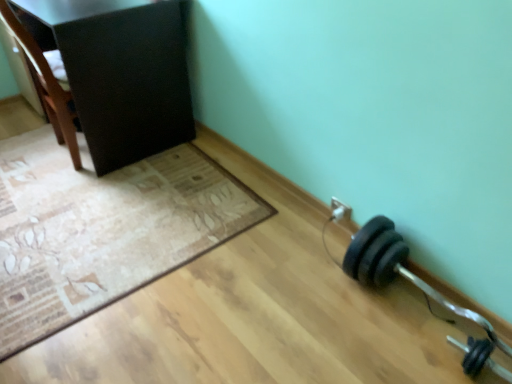
Question: From the image's perspective, is matte black cabinet at upper left over beige textured mat at lower left?

Choices:
 (A) no
 (B) yes

Answer: (B)

Question: Is matte black cabinet at upper left oriented towards beige textured mat at lower left?

Choices:
 (A) yes
 (B) no

Answer: (B)

Question: Does matte black cabinet at upper left come behind beige textured mat at lower left?

Choices:
 (A) no
 (B) yes

Answer: (B)

Question: Is matte black cabinet at upper left turned away from beige textured mat at lower left?

Choices:
 (A) yes
 (B) no

Answer: (B)

Question: Can we say matte black cabinet at upper left lies outside beige textured mat at lower left?

Choices:
 (A) no
 (B) yes

Answer: (B)

Question: Is point (463, 365) closer or farther from the camera than point (465, 350)?

Choices:
 (A) farther
 (B) closer

Answer: (B)

Question: Is black rubber dumbbell at lower right, which is the 1th dumbbell from top to bottom, taller or shorter than black rubber dumbbell at lower right, placed as the 1th dumbbell when sorted from bottom to top?

Choices:
 (A) tall
 (B) short

Answer: (A)

Question: Is black rubber dumbbell at lower right, which is the 1th dumbbell from top to bottom, bigger or smaller than black rubber dumbbell at lower right, the second dumbbell viewed from the top?

Choices:
 (A) big
 (B) small

Answer: (A)

Question: From the image's perspective, relative to black rubber dumbbell at lower right, placed as the 1th dumbbell when sorted from bottom to top, is black rubber dumbbell at lower right, the second dumbbell when ordered from bottom to top, above or below?

Choices:
 (A) above
 (B) below

Answer: (A)

Question: Is black rubber dumbbell at lower right, the second dumbbell when ordered from bottom to top, wider or thinner than brown wood chair at upper left?

Choices:
 (A) thin
 (B) wide

Answer: (A)

Question: From a real-world perspective, is black rubber dumbbell at lower right, which is the 1th dumbbell from top to bottom, physically located above or below brown wood chair at upper left?

Choices:
 (A) above
 (B) below

Answer: (B)

Question: Looking at the image, does black rubber dumbbell at lower right, which is the 1th dumbbell from top to bottom, seem bigger or smaller compared to brown wood chair at upper left?

Choices:
 (A) small
 (B) big

Answer: (A)

Question: In the image, is black rubber dumbbell at lower right, the second dumbbell when ordered from bottom to top, positioned in front of or behind brown wood chair at upper left?

Choices:
 (A) behind
 (B) front

Answer: (B)

Question: Based on their sizes in the image, would you say black rubber dumbbell at lower right, the second dumbbell viewed from the top, is bigger or smaller than black rubber dumbbell at lower right, which is the 1th dumbbell from top to bottom?

Choices:
 (A) small
 (B) big

Answer: (A)

Question: Relative to black rubber dumbbell at lower right, the second dumbbell when ordered from bottom to top, is black rubber dumbbell at lower right, placed as the 1th dumbbell when sorted from bottom to top, in front or behind?

Choices:
 (A) behind
 (B) front

Answer: (B)